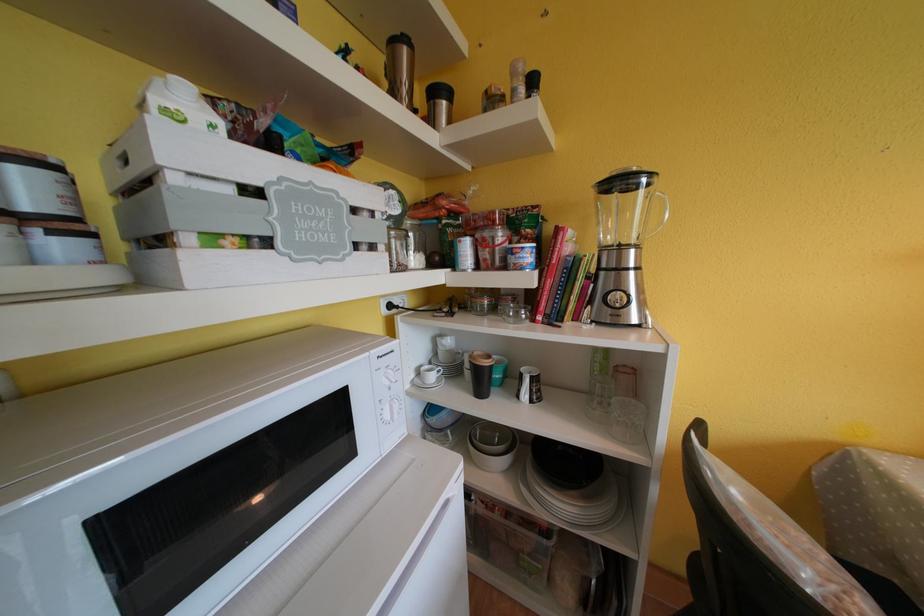
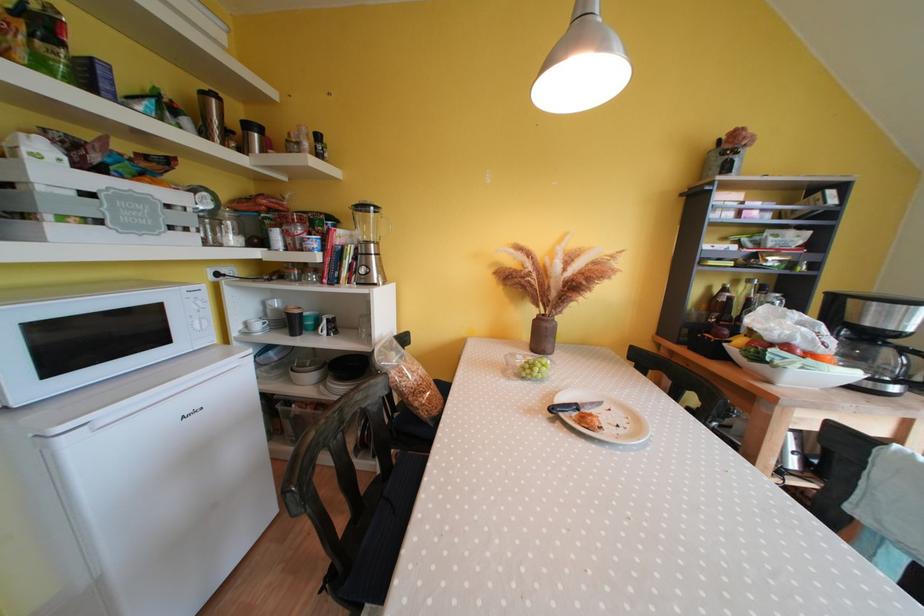
Where in the second image is the point corresponding to point (383, 235) from the first image?

(196, 224)